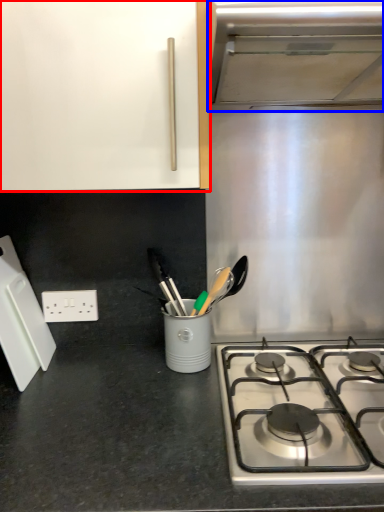
Question: Which object is further to the camera taking this photo, cabinetry (highlighted by a red box) or vent (highlighted by a blue box)?

Choices:
 (A) cabinetry
 (B) vent

Answer: (A)